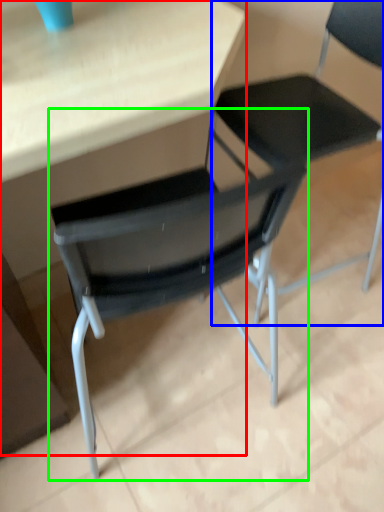
Question: Which object is the farthest from table (highlighted by a red box)? Choose among these: chair (highlighted by a blue box) or chair (highlighted by a green box).

Choices:
 (A) chair
 (B) chair

Answer: (A)